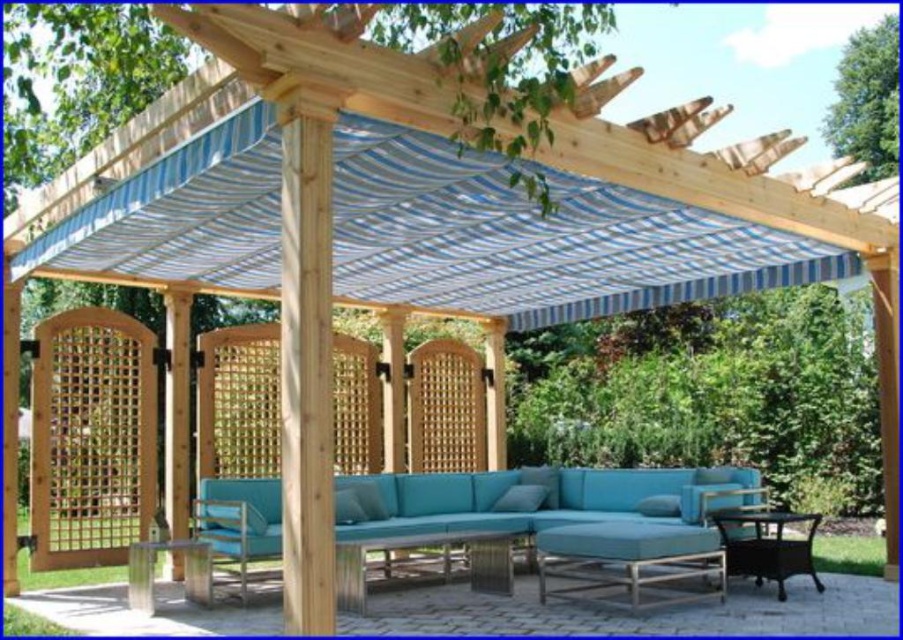
Question: In this image, where is blue striped fabric canopy at upper center located relative to teal fabric couch at center?

Choices:
 (A) left
 (B) right

Answer: (B)

Question: Which object appears closest to the camera in this image?

Choices:
 (A) teal fabric ottoman at center
 (B) blue striped fabric canopy at upper center
 (C) metallic silver chair at lower left

Answer: (B)

Question: Can you confirm if blue striped fabric canopy at upper center is positioned to the right of teal fabric ottoman at center?

Choices:
 (A) yes
 (B) no

Answer: (A)

Question: Among these points, which one is farthest from the camera?

Choices:
 (A) (704, 570)
 (B) (424, 266)

Answer: (B)

Question: Is blue striped fabric canopy at upper center wider than metallic silver chair at lower left?

Choices:
 (A) yes
 (B) no

Answer: (B)

Question: Which point is farther to the camera?

Choices:
 (A) (806, 564)
 (B) (583, 536)

Answer: (A)